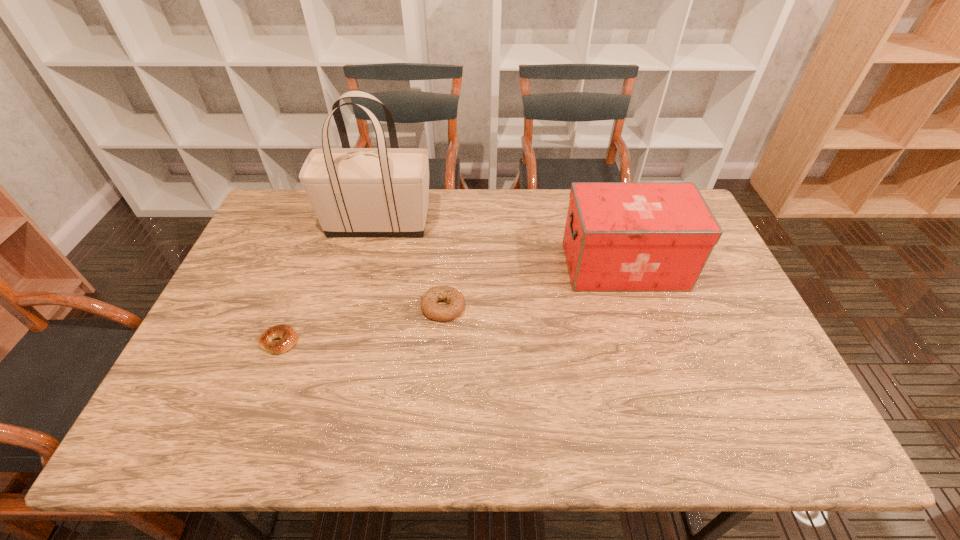
Find the location of a particular element. This screenshot has height=540, width=960. free spot at the right edge of the desktop is located at coordinates (710, 333).

In the image, there is a desktop. Where is `vacant space at the near right corner`? vacant space at the near right corner is located at coordinates (788, 421).

This screenshot has height=540, width=960. What are the coordinates of `free point between the shopping bag and the nearest object` in the screenshot? It's located at (329, 283).

This screenshot has width=960, height=540. Identify the location of empty space that is in between the farthest object and the taller bagel. (411, 266).

Image resolution: width=960 pixels, height=540 pixels. Find the location of `free spot between the rightmost object and the farthest object`. free spot between the rightmost object and the farthest object is located at coordinates (501, 245).

The width and height of the screenshot is (960, 540). I want to click on vacant area that lies between the taller bagel and the shortest object, so click(361, 324).

Image resolution: width=960 pixels, height=540 pixels. Find the location of `free space between the farther bagel and the shortest object`. free space between the farther bagel and the shortest object is located at coordinates (361, 324).

At what (x,y) coordinates should I click in order to perform the action: click on free space that is in between the nearer bagel and the farther bagel. Please return your answer as a coordinate pair (x, y). The width and height of the screenshot is (960, 540). Looking at the image, I should click on (361, 324).

This screenshot has width=960, height=540. Find the location of `unoccupied position between the farthest object and the farther bagel`. unoccupied position between the farthest object and the farther bagel is located at coordinates (411, 266).

This screenshot has height=540, width=960. Identify the location of unoccupied area between the right bagel and the shopping bag. coord(411,266).